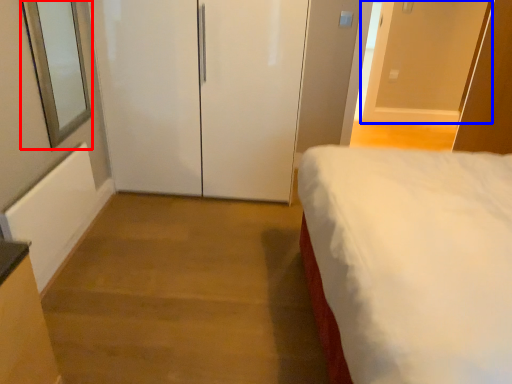
Question: Which object is further to the camera taking this photo, window screen (highlighted by a red box) or door (highlighted by a blue box)?

Choices:
 (A) window screen
 (B) door

Answer: (B)